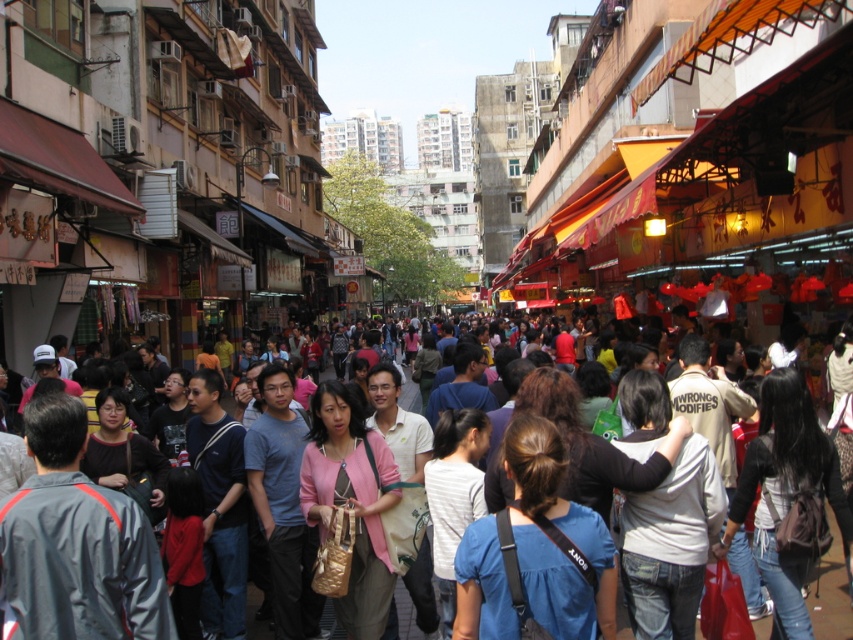
Which is more to the left, gray fabric jacket at center or pink fabric jacket at center?

gray fabric jacket at center

Is gray fabric jacket at center below pink fabric jacket at center?

No, gray fabric jacket at center is not below pink fabric jacket at center.

Who is more distant from viewer, (51,566) or (383,564)?

The point (383,564) is behind.

The height and width of the screenshot is (640, 853). Identify the location of gray fabric jacket at center. (76, 544).

Is blue fabric shirt at center thinner than matte black jacket at center?

Yes.

Is blue fabric shirt at center closer to camera compared to matte black jacket at center?

Yes, blue fabric shirt at center is closer to the viewer.

Is point (613, 618) closer to camera compared to point (90, 468)?

Yes, point (613, 618) is closer to viewer.

I want to click on blue fabric shirt at center, so click(535, 552).

Can you confirm if blue fabric shirt at center is positioned below pink fabric purse at center?

Actually, blue fabric shirt at center is above pink fabric purse at center.

This screenshot has height=640, width=853. What do you see at coordinates (535, 552) in the screenshot?
I see `blue fabric shirt at center` at bounding box center [535, 552].

Who is more forward, [554,518] or [834,552]?

Point [554,518] is in front.

The image size is (853, 640). I want to click on blue fabric shirt at center, so click(535, 552).